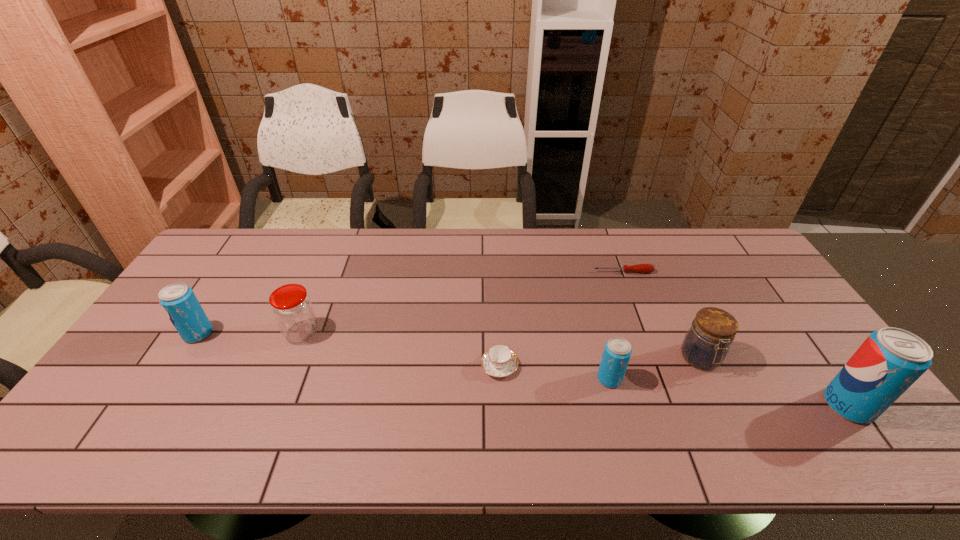
Find the location of a particular element. This screenshot has height=540, width=960. object that is positioned at the left edge is located at coordinates tap(178, 300).

The image size is (960, 540). In order to click on object at the right edge in this screenshot , I will do `click(890, 360)`.

Locate an element on the screen. The image size is (960, 540). object that is at the near right corner is located at coordinates (890, 360).

Identify the location of free space at the far edge of the desktop. (298, 237).

The height and width of the screenshot is (540, 960). I want to click on free spot at the near edge of the desktop, so click(x=251, y=394).

Where is `vacant region at the left edge`? The width and height of the screenshot is (960, 540). vacant region at the left edge is located at coordinates coord(232,282).

This screenshot has height=540, width=960. In the image, there is a desktop. Identify the location of blank space at the right edge. (743, 275).

Image resolution: width=960 pixels, height=540 pixels. Identify the location of free spot at the far right corner of the desktop. (703, 238).

Where is `free space between the teacup and the right jar`? free space between the teacup and the right jar is located at coordinates (600, 362).

In order to click on vacant area that lies between the screwdriver and the right jar in this screenshot , I will do `click(662, 315)`.